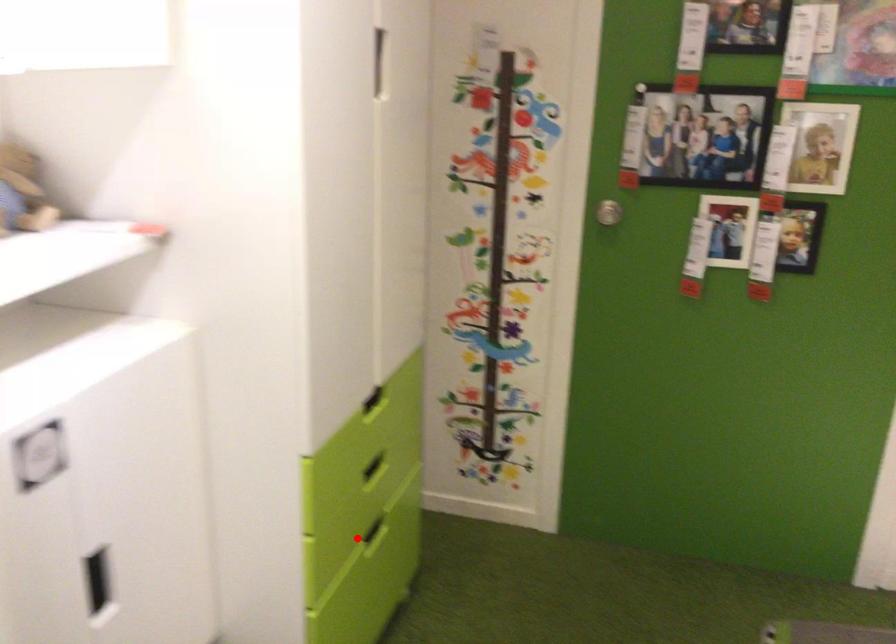
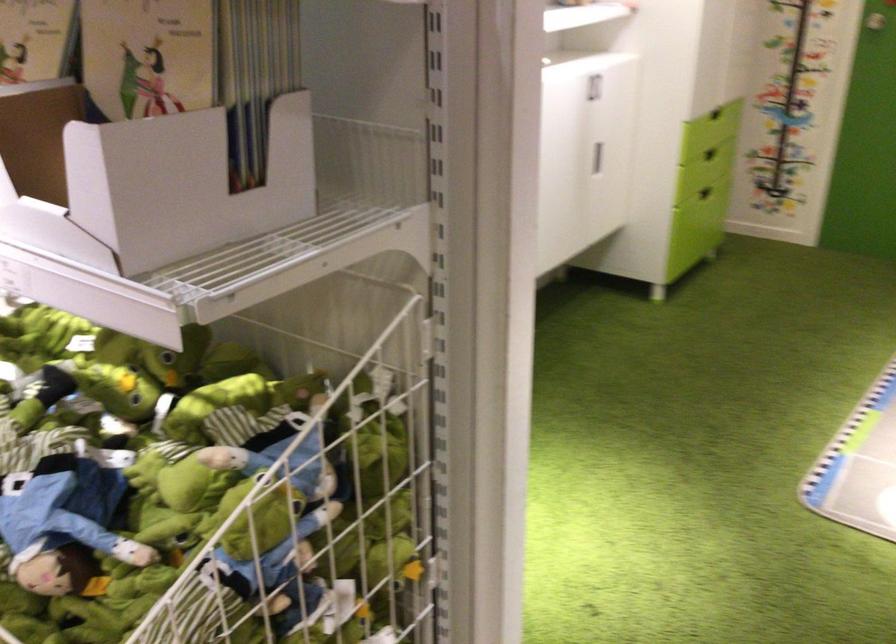
Find the pixel in the second image that matches the highlighted location in the first image.

(704, 193)